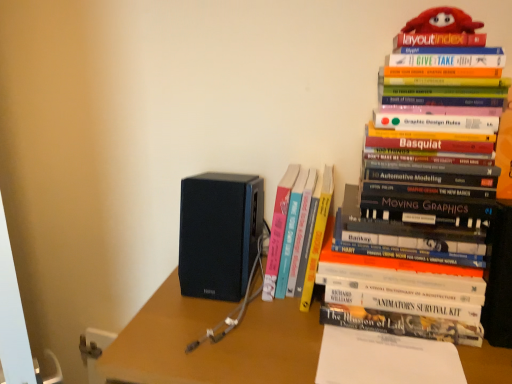
Image resolution: width=512 pixels, height=384 pixels. Identify the location of empty space that is ontop of matte black speaker at center (from a real-world perspective). (314, 333).